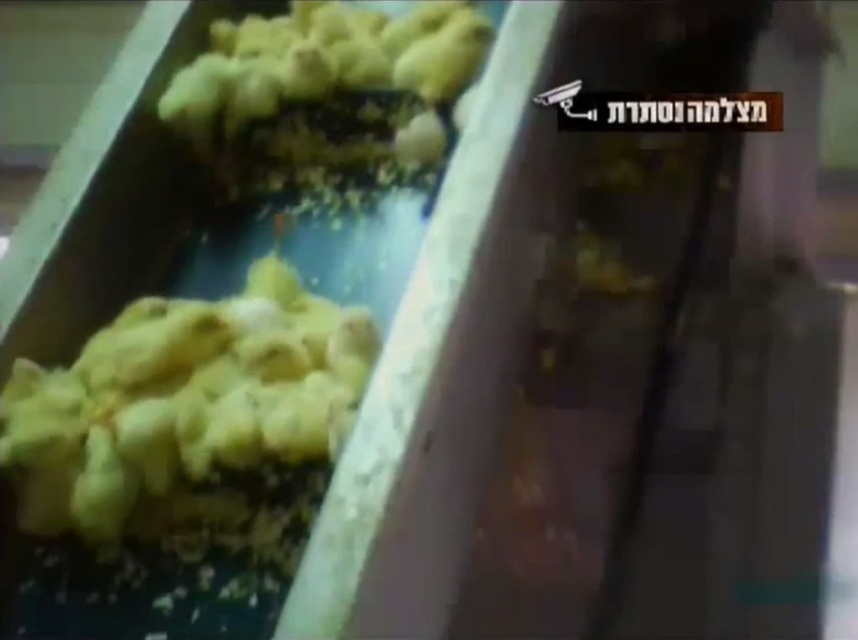
Consider the image. Who is lower down, yellow matte chicks at left or yellow matte chicks at upper left?

yellow matte chicks at left is below.

Between yellow matte chicks at left and yellow matte chicks at upper left, which one is positioned higher?

yellow matte chicks at upper left

The height and width of the screenshot is (640, 858). In order to click on yellow matte chicks at left in this screenshot , I will do `click(185, 413)`.

The height and width of the screenshot is (640, 858). Identify the location of yellow matte chicks at left. (185, 413).